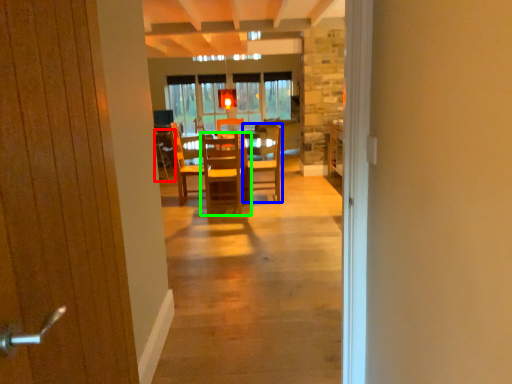
Question: Considering the real-world distances, which object is closest to armchair (highlighted by a red box)? chair (highlighted by a blue box) or chair (highlighted by a green box).

Choices:
 (A) chair
 (B) chair

Answer: (B)